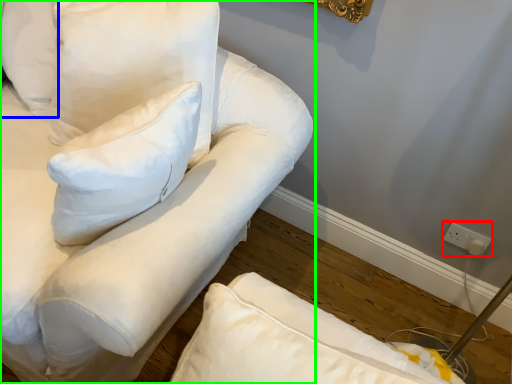
Question: Which object is the farthest from electric outlet (highlighted by a red box)? Choose among these: pillow (highlighted by a blue box) or furniture (highlighted by a green box).

Choices:
 (A) pillow
 (B) furniture

Answer: (A)